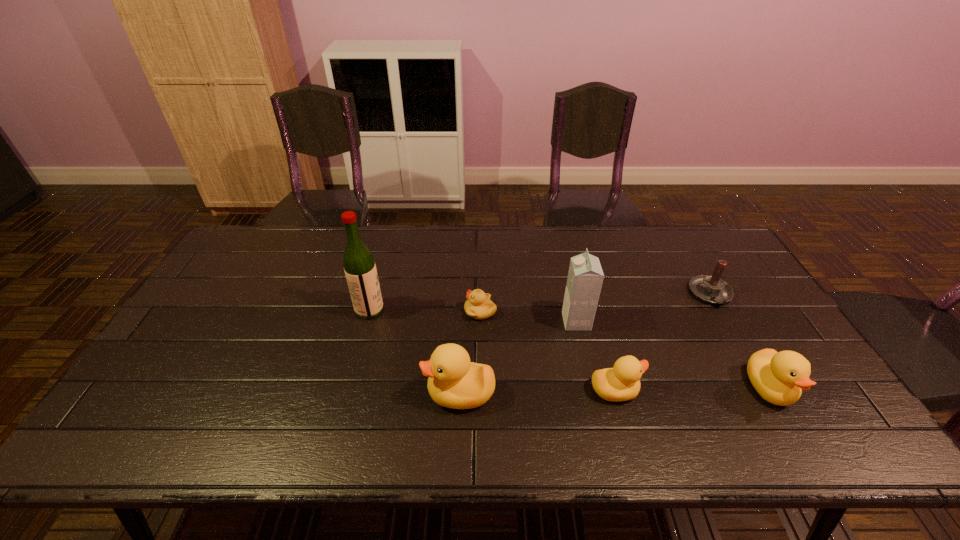
Given the evenly spaced ducklings in the image, where should an extra duckling be added on the left to preserve the spacing? Please point to a vacant space. Please provide its 2D coordinates. Your answer should be formatted as a tuple, i.e. [(x, y)], where the tuple contains the x and y coordinates of a point satisfying the conditions above.

[(302, 396)]